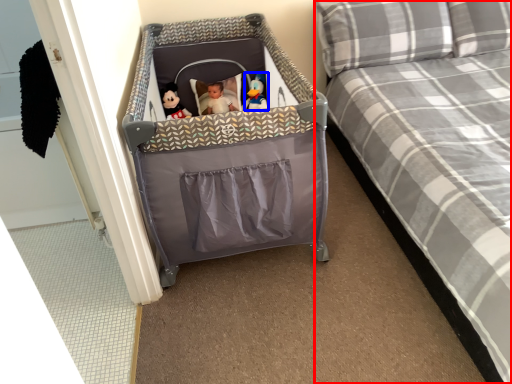
Question: Which object is further to the camera taking this photo, bed (highlighted by a red box) or toy (highlighted by a blue box)?

Choices:
 (A) bed
 (B) toy

Answer: (B)